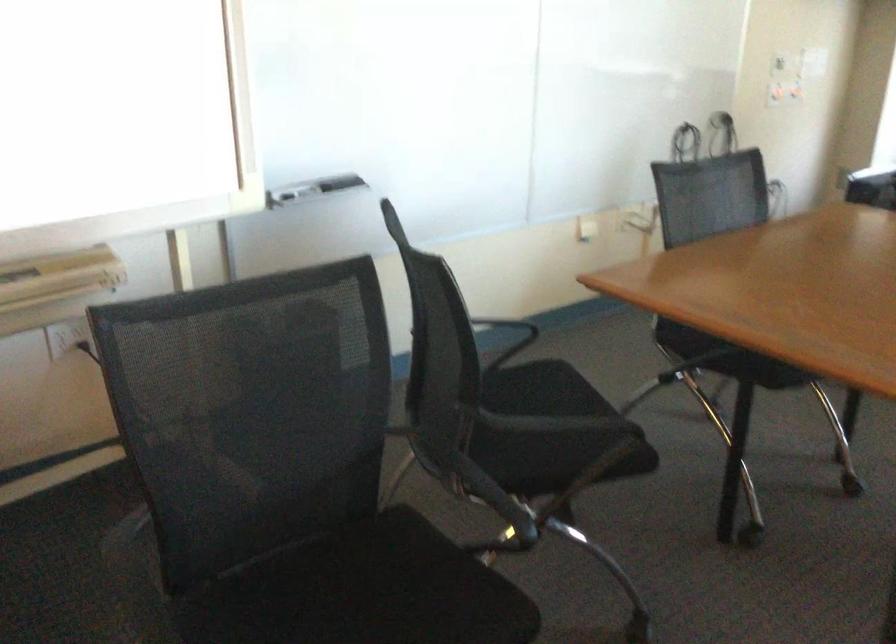
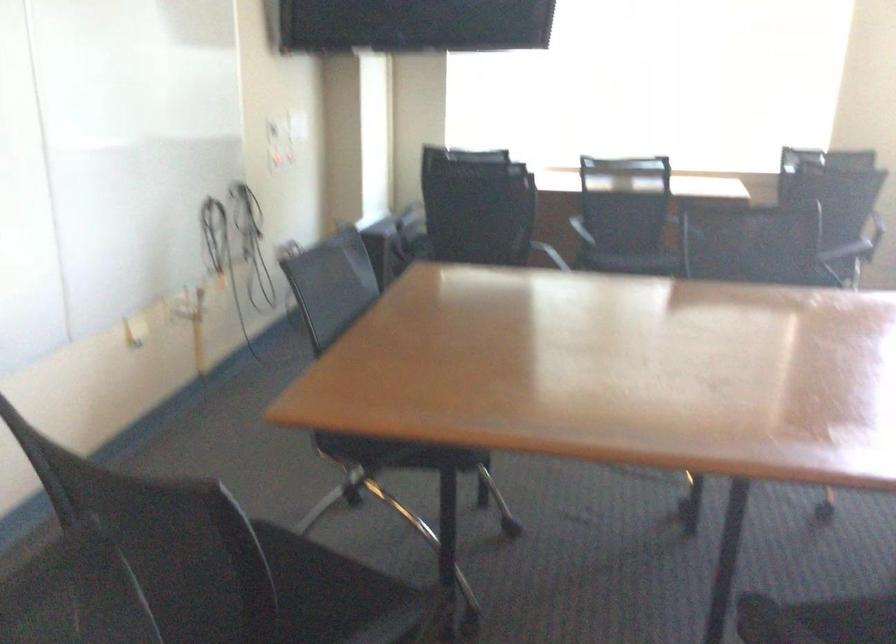
Question: The camera is either moving clockwise (left) or counter-clockwise (right) around the object. The first image is from the beginning of the video and the second image is from the end. Is the camera moving left or right when shooting the video?

Choices:
 (A) Left
 (B) Right

Answer: (A)